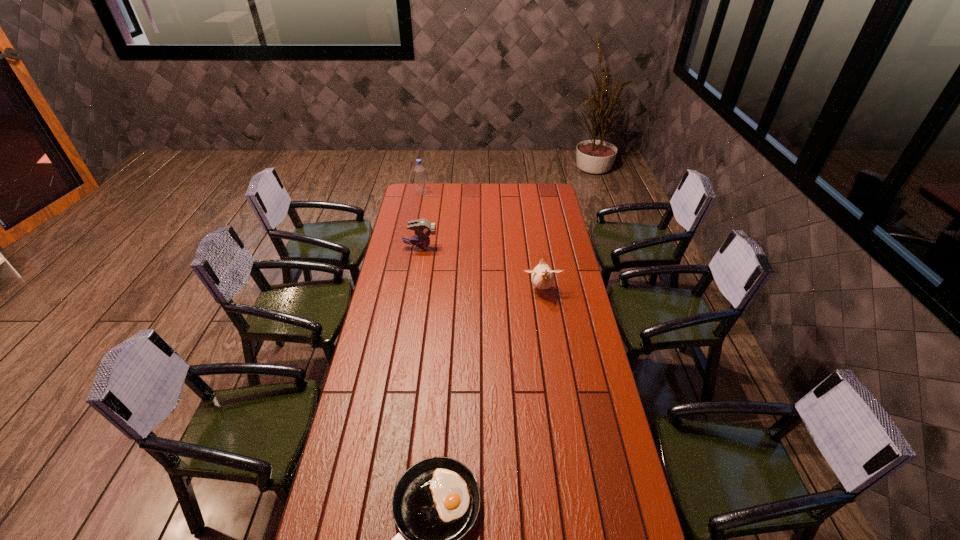
At what (x,y) coordinates should I click in order to perform the action: click on the tallest object. Please return your answer as a coordinate pair (x, y). Looking at the image, I should click on (420, 180).

I want to click on bottle, so click(x=420, y=180).

This screenshot has width=960, height=540. Identify the location of the right bird. (542, 277).

This screenshot has height=540, width=960. Identify the location of the nearer bird. (542, 277).

This screenshot has width=960, height=540. Find the location of `the farther bird`. the farther bird is located at coordinates (423, 228).

Where is `the left bird`? the left bird is located at coordinates (423, 228).

Find the location of a particular element. vacant space located 0.340m on the right of the bottle is located at coordinates (483, 193).

You are a GUI agent. You are given a task and a screenshot of the screen. Output one action in this format:
    pyautogui.click(x=<x>, y=<y>)
    Task: Click on the free space located at the beak of the rightmost object
    Image resolution: width=960 pixels, height=540 pixels.
    Given the screenshot: What is the action you would take?
    554,374

Find the location of a particular element. blank space located 0.080m at the beak of the farther bird is located at coordinates (452, 248).

The height and width of the screenshot is (540, 960). Find the location of `object situated at the far edge`. object situated at the far edge is located at coordinates (420, 180).